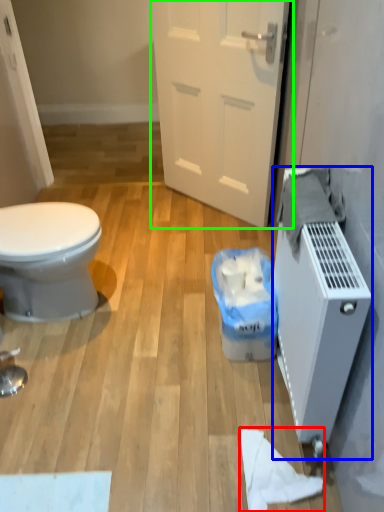
Question: Which object is the farthest from toilet paper (highlighted by a red box)? Choose among these: water heater (highlighted by a blue box) or door (highlighted by a green box).

Choices:
 (A) water heater
 (B) door

Answer: (B)